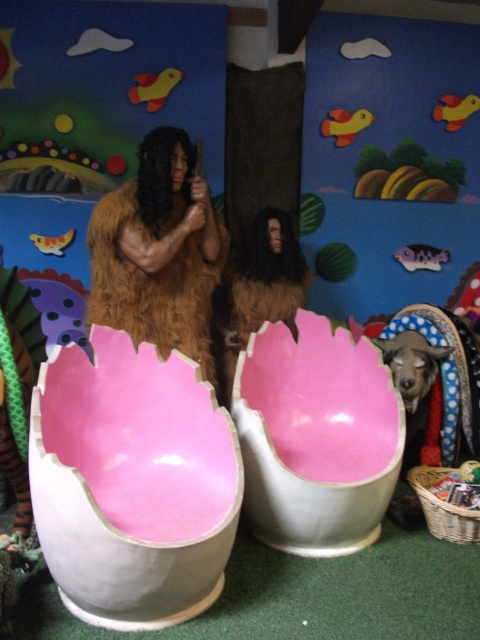
Between brown furry costume at center and shiny black dog at lower right, which one has less height?

shiny black dog at lower right is shorter.

Is point (175, 256) positioned in front of point (430, 365)?

That is True.

Who is more forward, (113, 262) or (441, 356)?

Point (113, 262) is in front.

At what (x,y) coordinates should I click in order to perform the action: click on brown furry costume at center. Please return your answer as a coordinate pair (x, y). This screenshot has width=480, height=640. Looking at the image, I should click on (157, 252).